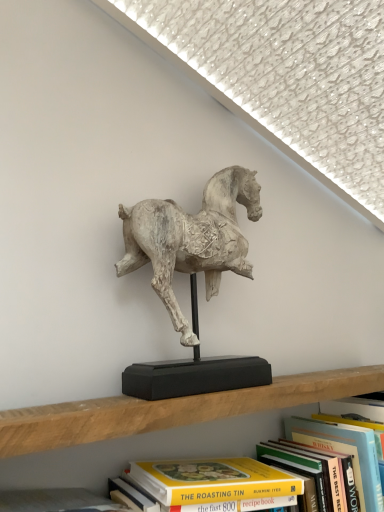
Question: Which direction should I rotate to look at yellow paperback book at center, placed as the first book when sorted from left to right?

Choices:
 (A) left
 (B) right

Answer: (B)

Question: Can you confirm if white textured horse at center is thinner than hardcover book at upper center, the 2th book in the left-to-right sequence?

Choices:
 (A) yes
 (B) no

Answer: (A)

Question: Can you confirm if white textured horse at center is taller than hardcover book at upper center, arranged as the 1th book when viewed from the right?

Choices:
 (A) yes
 (B) no

Answer: (A)

Question: Considering the relative positions of white textured horse at center and hardcover book at upper center, arranged as the 1th book when viewed from the right, in the image provided, is white textured horse at center to the left of hardcover book at upper center, arranged as the 1th book when viewed from the right, from the viewer's perspective?

Choices:
 (A) no
 (B) yes

Answer: (B)

Question: Is white textured horse at center aimed at hardcover book at upper center, the 2th book in the left-to-right sequence?

Choices:
 (A) yes
 (B) no

Answer: (B)

Question: Does white textured horse at center have a lesser height compared to hardcover book at upper center, arranged as the 1th book when viewed from the right?

Choices:
 (A) no
 (B) yes

Answer: (A)

Question: Does white textured horse at center come in front of hardcover book at upper center, the 2th book in the left-to-right sequence?

Choices:
 (A) no
 (B) yes

Answer: (B)

Question: Does yellow paperback book at center, positioned as the 2th book in right-to-left order, touch white textured horse at center?

Choices:
 (A) no
 (B) yes

Answer: (A)

Question: Is yellow paperback book at center, placed as the first book when sorted from left to right, completely or partially outside of white textured horse at center?

Choices:
 (A) no
 (B) yes

Answer: (B)

Question: From a real-world perspective, is yellow paperback book at center, placed as the first book when sorted from left to right, below white textured horse at center?

Choices:
 (A) no
 (B) yes

Answer: (B)

Question: Is yellow paperback book at center, positioned as the 2th book in right-to-left order, positioned before white textured horse at center?

Choices:
 (A) no
 (B) yes

Answer: (B)

Question: Can you confirm if yellow paperback book at center, positioned as the 2th book in right-to-left order, is positioned to the left of white textured horse at center?

Choices:
 (A) yes
 (B) no

Answer: (B)

Question: Is yellow paperback book at center, positioned as the 2th book in right-to-left order, taller than white textured horse at center?

Choices:
 (A) no
 (B) yes

Answer: (A)

Question: Is hardcover book at upper center, arranged as the 1th book when viewed from the right, oriented towards yellow paperback book at center, placed as the first book when sorted from left to right?

Choices:
 (A) no
 (B) yes

Answer: (A)